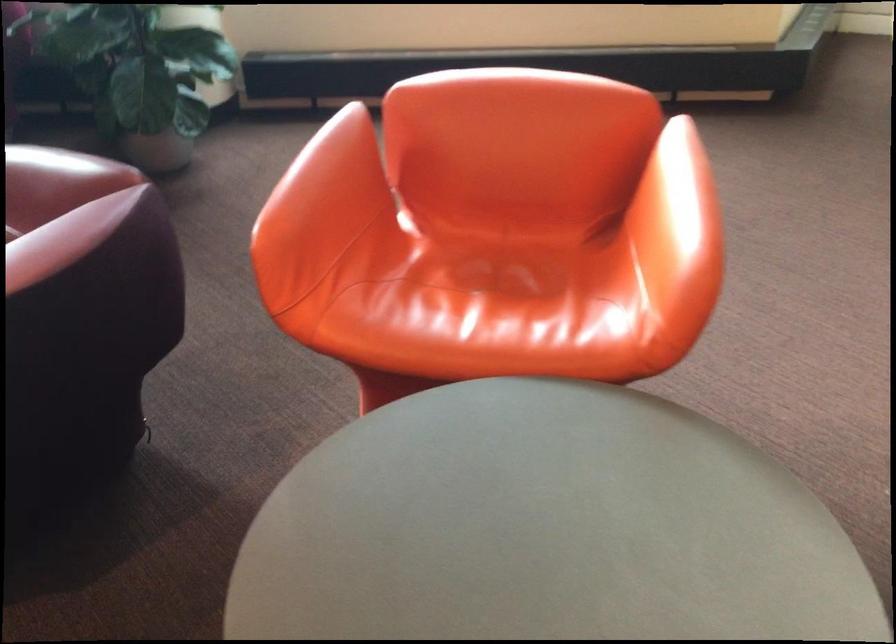
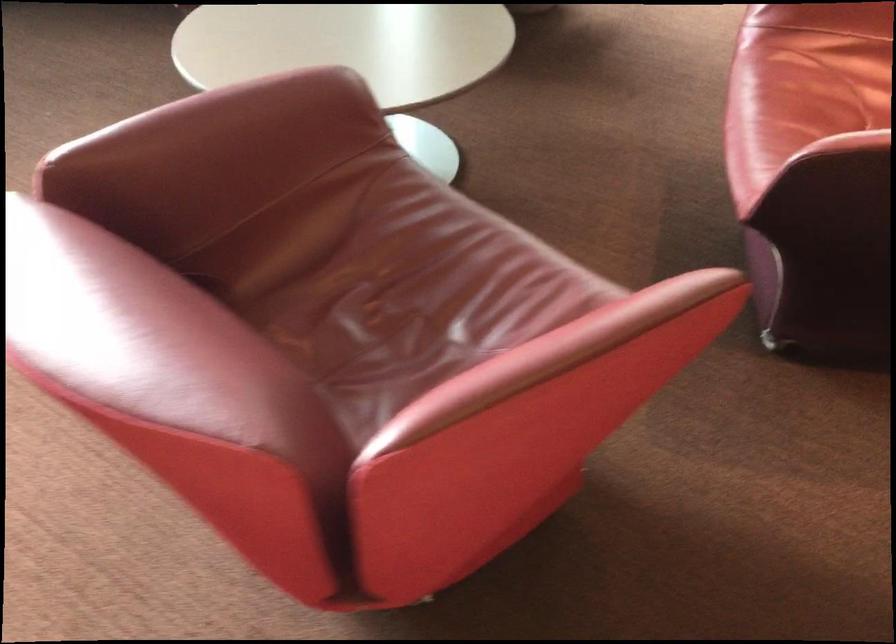
Question: Which direction would the cameraman need to move to produce the second image? Reply with the corresponding letter.

Choices:
 (A) Left
 (B) Right
 (C) Forward
 (D) Backward

Answer: (A)